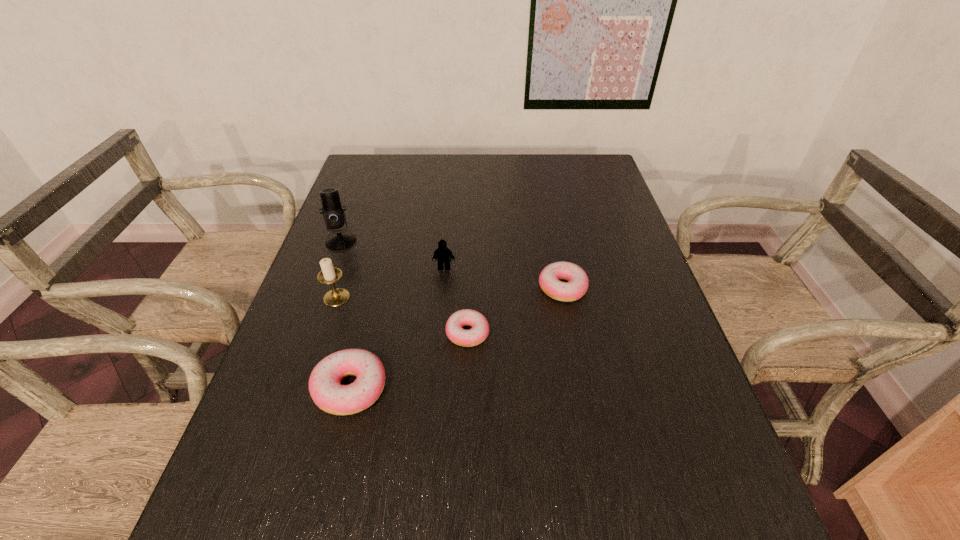
Please point a spot to add another doughnut on the right. Please provide its 2D coordinates. Your answer should be formatted as a tuple, i.e. [(x, y)], where the tuple contains the x and y coordinates of a point satisfying the conditions above.

[(640, 251)]